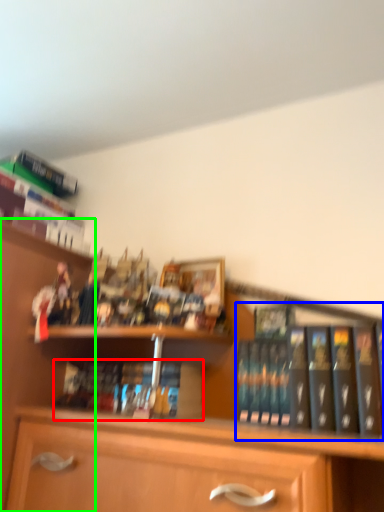
Question: Which object is the farthest from book (highlighted by a red box)? Choose among these: book (highlighted by a blue box) or shelf (highlighted by a green box).

Choices:
 (A) book
 (B) shelf

Answer: (A)